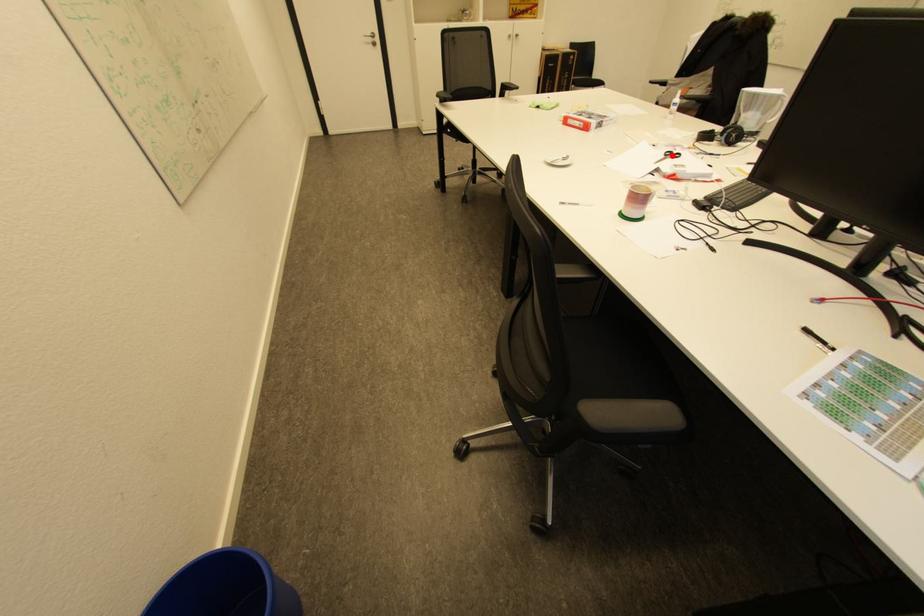
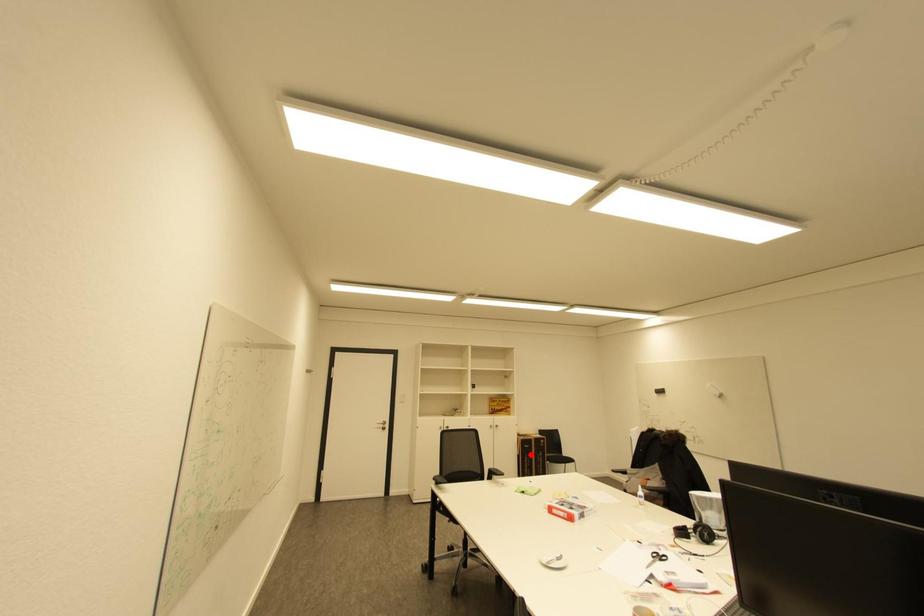
I am providing you with two images of the same scene from different viewpoints. A red point is marked on the first image and another point is marked on the second image. Is the marked point in image1 the same physical position as the marked point in image2?

No